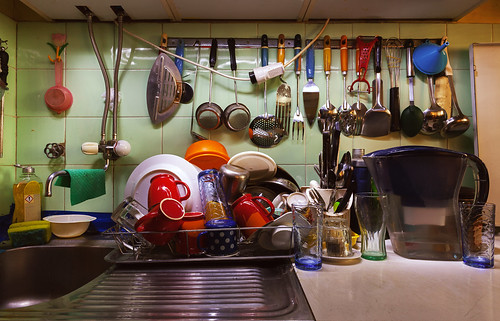
Where is `ridges in sink`? The width and height of the screenshot is (500, 321). ridges in sink is located at coordinates (252, 270), (253, 274), (250, 277), (253, 282), (250, 286), (250, 289), (250, 296), (248, 300).